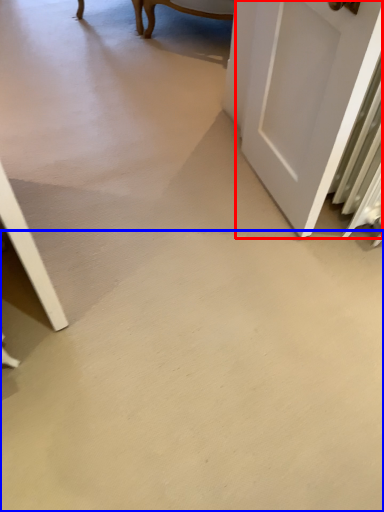
Question: Which object appears farthest to the camera in this image, door (highlighted by a red box) or concrete (highlighted by a blue box)?

Choices:
 (A) door
 (B) concrete

Answer: (A)